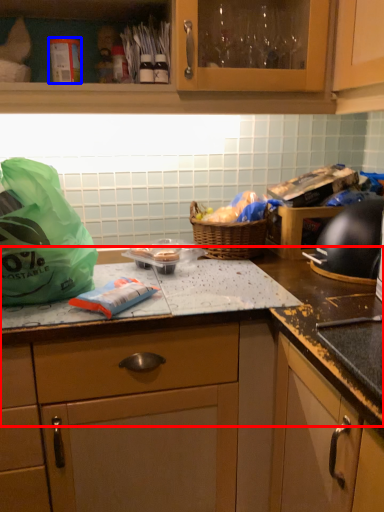
Question: Which point is closer to the camera, countertop (highlighted by a red box) or kitchen appliance (highlighted by a blue box)?

Choices:
 (A) countertop
 (B) kitchen appliance

Answer: (A)